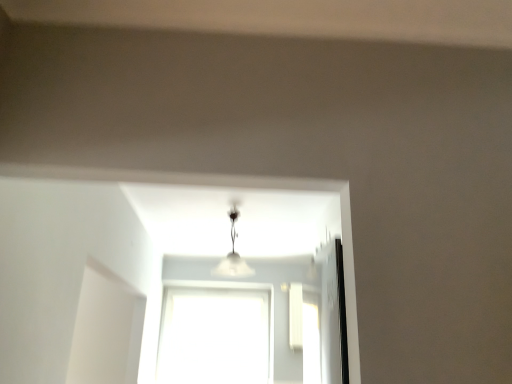
Question: Is white frosted glass lamp at center surrounding transparent glass window at center?

Choices:
 (A) no
 (B) yes

Answer: (A)

Question: Is white frosted glass lamp at center closer to camera compared to transparent glass window at center?

Choices:
 (A) no
 (B) yes

Answer: (B)

Question: Is white frosted glass lamp at center completely or partially outside of transparent glass window at center?

Choices:
 (A) no
 (B) yes

Answer: (B)

Question: Is white frosted glass lamp at center shorter than transparent glass window at center?

Choices:
 (A) yes
 (B) no

Answer: (A)

Question: Can you confirm if white frosted glass lamp at center is thinner than transparent glass window at center?

Choices:
 (A) no
 (B) yes

Answer: (A)

Question: Is white frosted glass lamp at center touching transparent glass window at center?

Choices:
 (A) yes
 (B) no

Answer: (B)

Question: Are transparent glass window at center and white frosted glass lamp at center beside each other?

Choices:
 (A) no
 (B) yes

Answer: (A)

Question: Is transparent glass window at center further to camera compared to white frosted glass lamp at center?

Choices:
 (A) yes
 (B) no

Answer: (A)

Question: Does transparent glass window at center have a larger size compared to white frosted glass lamp at center?

Choices:
 (A) yes
 (B) no

Answer: (A)

Question: Is transparent glass window at center located outside white frosted glass lamp at center?

Choices:
 (A) yes
 (B) no

Answer: (A)

Question: Considering the relative sizes of transparent glass window at center and white frosted glass lamp at center in the image provided, is transparent glass window at center wider than white frosted glass lamp at center?

Choices:
 (A) yes
 (B) no

Answer: (B)

Question: Is transparent glass window at center positioned in front of white frosted glass lamp at center?

Choices:
 (A) no
 (B) yes

Answer: (A)

Question: In terms of size, does transparent glass window at center appear bigger or smaller than white frosted glass lamp at center?

Choices:
 (A) big
 (B) small

Answer: (A)